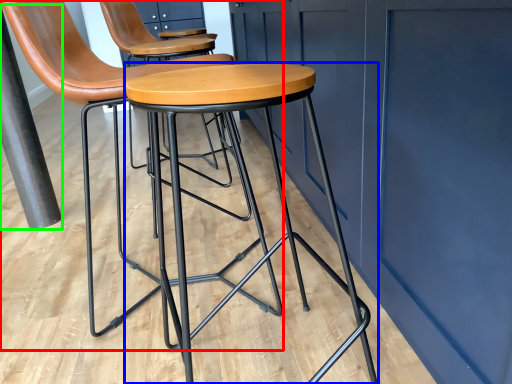
Question: Based on their relative distances, which object is farther from chair (highlighted by a red box)? Choose from stool (highlighted by a blue box) and pole (highlighted by a green box).

Choices:
 (A) stool
 (B) pole

Answer: (B)